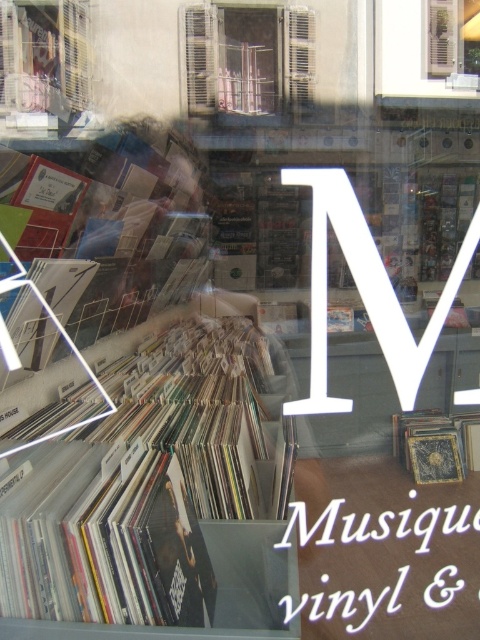
Question: Which object appears farthest from the camera in this image?

Choices:
 (A) white glass window at upper center
 (B) matte cardboard book at center
 (C) metallic window at upper center
 (D) gold textured vinyl record at center

Answer: (D)

Question: Is white glass window at upper center above white wooden shutters at upper center?

Choices:
 (A) yes
 (B) no

Answer: (B)

Question: Can you confirm if matte cardboard book at center is smaller than gold textured vinyl record at center?

Choices:
 (A) no
 (B) yes

Answer: (A)

Question: Among these objects, which one is nearest to the camera?

Choices:
 (A) white wooden shutters at upper center
 (B) gold textured vinyl record at center
 (C) white glass window at upper center
 (D) metallic window at upper center

Answer: (C)

Question: In this image, where is matte plastic window at upper left located relative to gold textured vinyl record at center?

Choices:
 (A) right
 (B) left

Answer: (B)

Question: Which point is closer to the camera?

Choices:
 (A) (187, 10)
 (B) (36, 92)
 (C) (69, 253)

Answer: (A)